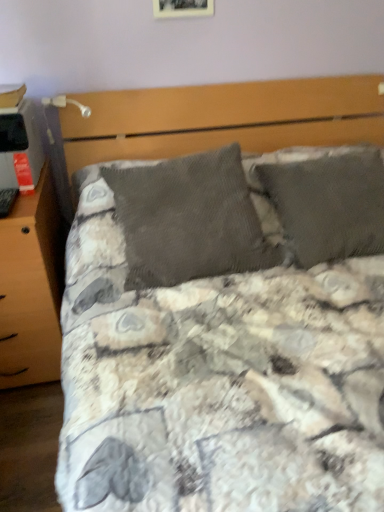
Question: Relative to wooden photo frame at upper center, is wooden nightstand at left in front or behind?

Choices:
 (A) front
 (B) behind

Answer: (A)

Question: Considering the positions of wooden nightstand at left and wooden photo frame at upper center in the image, is wooden nightstand at left bigger or smaller than wooden photo frame at upper center?

Choices:
 (A) big
 (B) small

Answer: (A)

Question: Estimate the real-world distances between objects in this image. Which object is farther from the wooden photo frame at upper center?

Choices:
 (A) matte black desktop at left
 (B) metallic silver table lamp at upper left
 (C) wooden nightstand at left

Answer: (C)

Question: Which is nearer to the metallic silver table lamp at upper left?

Choices:
 (A) matte black desktop at left
 (B) wooden photo frame at upper center
 (C) wooden nightstand at left

Answer: (A)